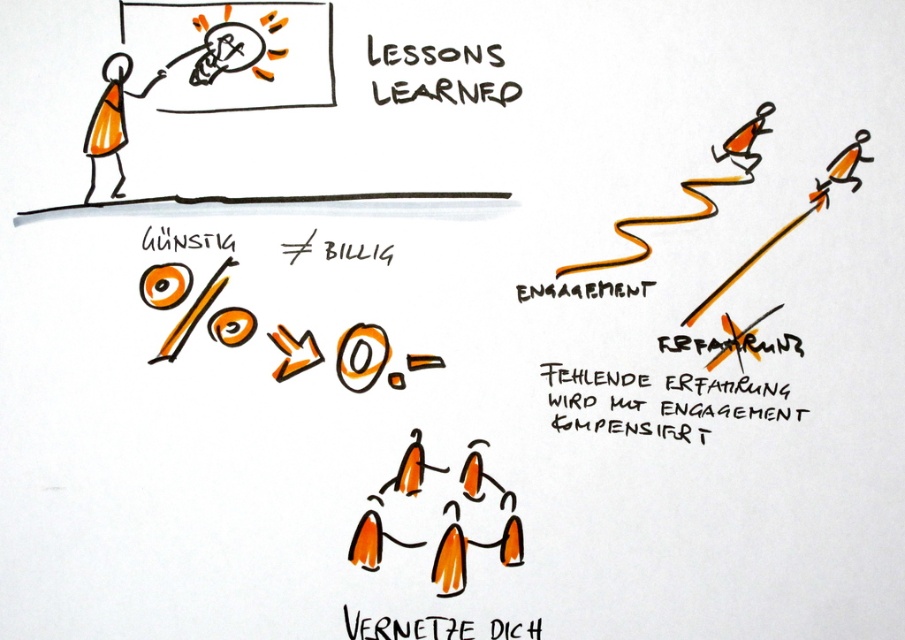
Question: Considering the relative positions of black paper text at lower center and orange matte stick figure at upper right in the image provided, where is black paper text at lower center located with respect to orange matte stick figure at upper right?

Choices:
 (A) below
 (B) above

Answer: (A)

Question: Considering the relative positions of brown handwritten text at upper center and black paper text at lower center in the image provided, where is brown handwritten text at upper center located with respect to black paper text at lower center?

Choices:
 (A) above
 (B) below

Answer: (A)

Question: Estimate the real-world distances between objects in this image. Which object is farther from the orange text at upper center?

Choices:
 (A) orange paper man at upper left
 (B) orange matte stick figure at upper right

Answer: (A)

Question: Is orange matte stick figures at center wider than brown handwritten text at upper center?

Choices:
 (A) no
 (B) yes

Answer: (B)

Question: Which point is farther from the camera taking this photo?

Choices:
 (A) coord(119,163)
 (B) coord(417,454)
 (C) coord(513,627)
 (D) coord(424,54)

Answer: (C)

Question: Which point is closer to the camera taking this photo?

Choices:
 (A) (91, 145)
 (B) (832, 170)
 (C) (472, 458)

Answer: (B)